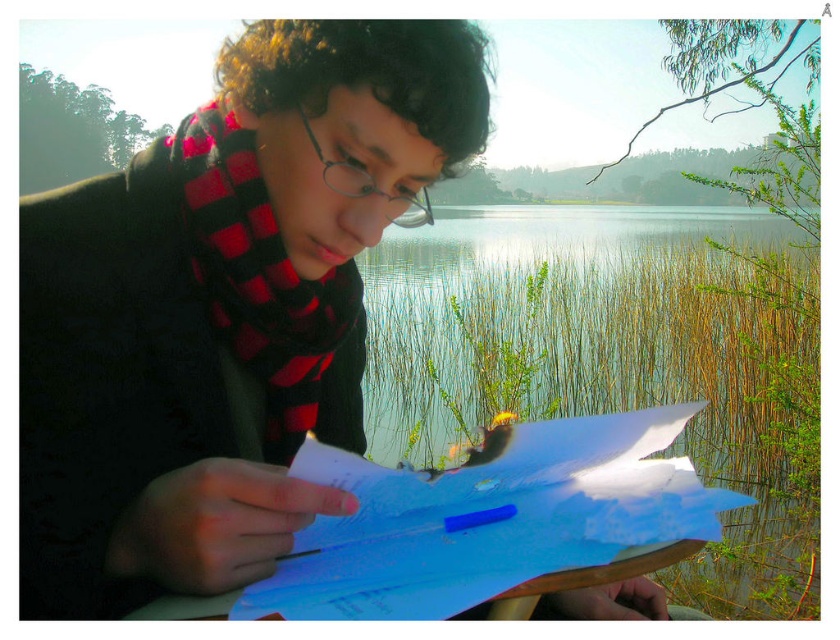
You are a photographer trying to capture a closeup shot of the person painting. Your camera has a lens that can focus on objects within a 2.5 inches range. If you aim at the matte black scarf at upper left, will the red plaid scarf at center also be in focus?

The distance between the matte black scarf at upper left and the red plaid scarf at center is 2.57 inches. Since the camera lens can focus within a 2.5 inches range, the red plaid scarf at center will be slightly out of focus.

You are an artist who wants to place a small decorative pin on the matte black scarf at upper left and the white paper at center. Since you have limited pins, you need to know which object requires a larger pin to secure it properly. Based on the scene, which object should you use the larger pin for?

The matte black scarf at upper left is larger in size than the white paper at center, so you should use the larger pin for the matte black scarf at upper left to secure it properly.